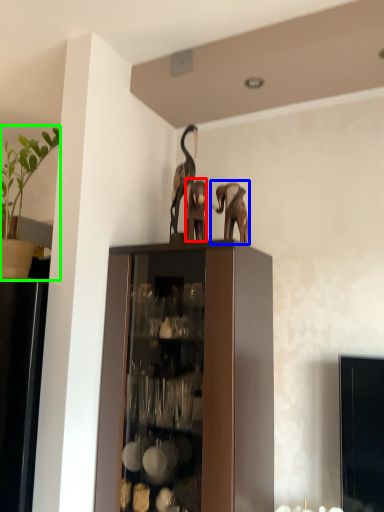
Question: Based on their relative distances, which object is farther from animal (highlighted by a red box)? Choose from elephant (highlighted by a blue box) and houseplant (highlighted by a green box).

Choices:
 (A) elephant
 (B) houseplant

Answer: (B)